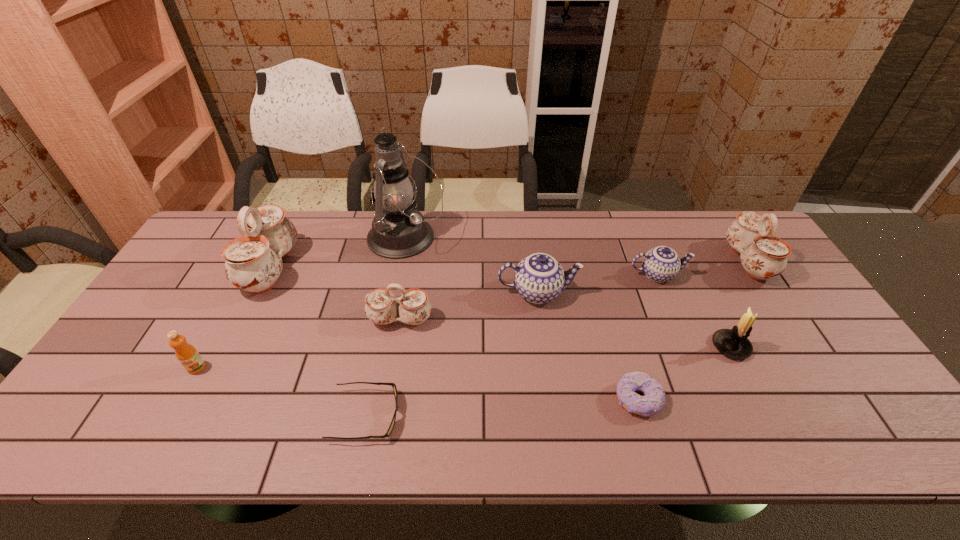
Identify the location of sunglasses present at the near edge. (393, 385).

The width and height of the screenshot is (960, 540). I want to click on object that is at the right edge, so click(763, 256).

Where is `object that is positioned at the far right corner`? This screenshot has width=960, height=540. object that is positioned at the far right corner is located at coordinates (763, 256).

Where is `free point at the far edge`? free point at the far edge is located at coordinates (490, 223).

The image size is (960, 540). What are the coordinates of `vacant space at the near edge of the desktop` in the screenshot? It's located at (577, 419).

In the image, there is a desktop. Where is `vacant space at the left edge`? This screenshot has height=540, width=960. vacant space at the left edge is located at coordinates (157, 311).

In the image, there is a desktop. Identify the location of free space at the right edge. The height and width of the screenshot is (540, 960). (790, 337).

What are the coordinates of `free space between the tallest object and the white candle holder` in the screenshot? It's located at (568, 293).

The height and width of the screenshot is (540, 960). I want to click on free spot between the orange juice and the rightmost white chinaware, so click(x=472, y=315).

Where is `vacant region between the shortest object and the orange juice`? The height and width of the screenshot is (540, 960). vacant region between the shortest object and the orange juice is located at coordinates (281, 392).